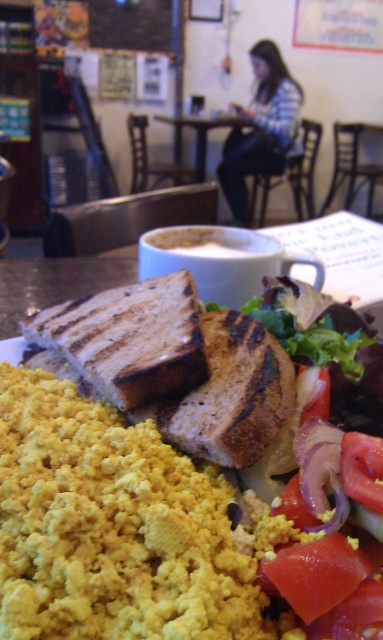
You are a food critic who wants to take a closeup photo of the grilled bread at center. The camera you are using has a minimum focusing distance of 24 inches. Can you take the photo without moving the bread?

The grilled bread at center is 24.54 inches away from the camera. Since the minimum focusing distance is 24 inches, the camera can focus on the grilled bread at center as it is slightly beyond the minimum distance required.

Based on the photo, you are a food delivery person who needs to describe the location of the grilled bread at center to your colleague. What coordinates would you use?

The grilled bread at center is located at coordinates point (129, 339).

You are a delivery robot standing at the entrance of the cafe. You need to place a small package at the point marked as point (32, 339). The package is 10 centimeters in height. Can you safely place it there without it falling off?

The distance of point (32, 339) from camera is 85.12 centimeters. Since the package is only 10 centimeters tall, it should be stable and not fall off when placed at that point.